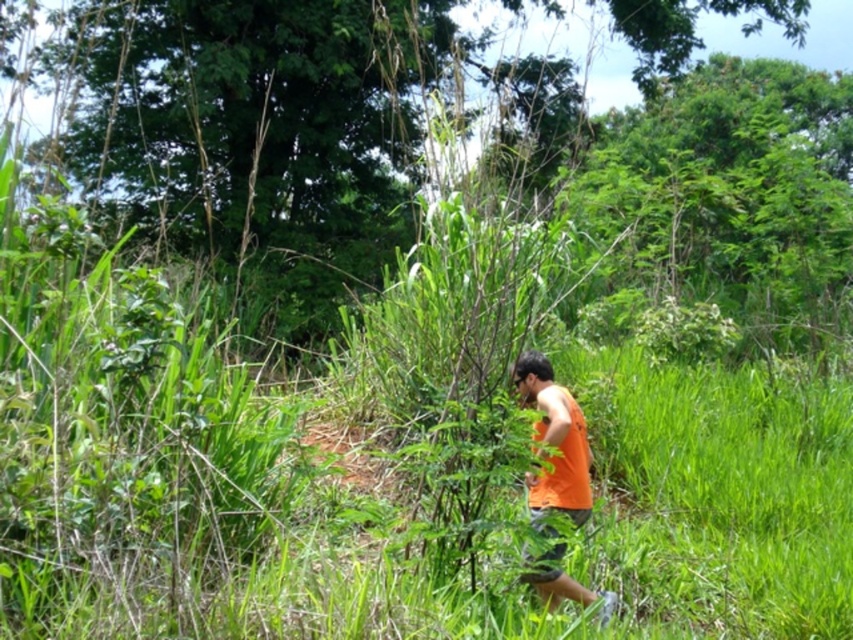
You are a hiker trying to find a clear path through the dense vegetation. You notice the green leafy tree at center and the orange fabric shirt at center. Which object is higher up in the scene?

The green leafy tree at center is located above the orange fabric shirt at center, so it is higher up in the scene.

You are a hiker trying to find your way through the dense vegetation. You notice the green leafy tree at center and the orange fabric shirt at center. Which object is bigger in size?

The green leafy tree at center is larger in size compared to the orange fabric shirt at center.

You are a hiker trying to find your way through the dense vegetation. You see a green leafy tree at center and an orange fabric shirt at center. Which object is located to the left of the other?

The green leafy tree at center is positioned on the left side of orange fabric shirt at center, so the tree is to the left of the shirt.